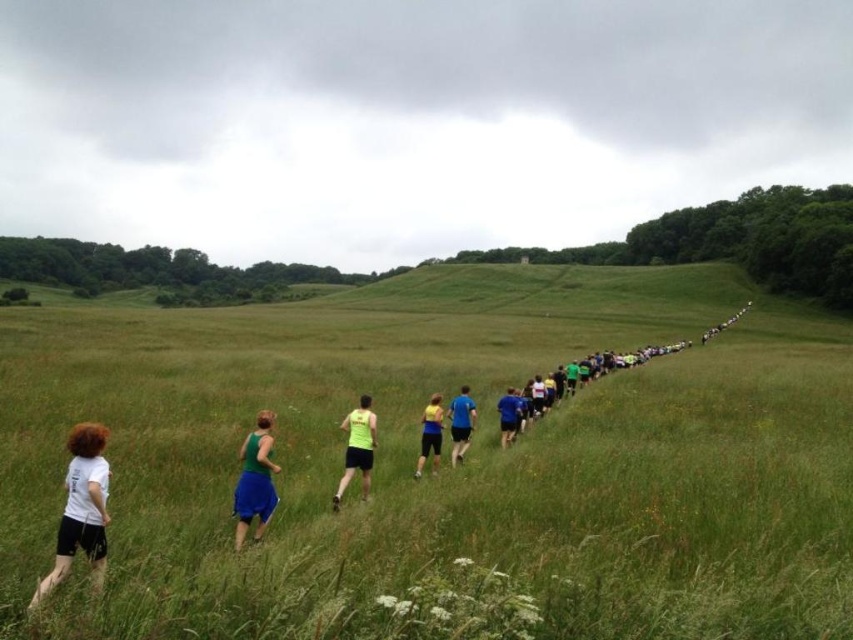
Question: Does green fabric skirt at lower left come behind blue fabric shorts at center?

Choices:
 (A) no
 (B) yes

Answer: (A)

Question: In this image, where is neon yellow tank top at center located relative to yellow fabric shorts at center?

Choices:
 (A) above
 (B) below

Answer: (A)

Question: Which point appears farthest from the camera in this image?

Choices:
 (A) (376, 541)
 (B) (456, 396)

Answer: (B)

Question: Does green grassy field at center have a larger size compared to white matte t-shirt at lower left?

Choices:
 (A) no
 (B) yes

Answer: (B)

Question: Which point is farther from the camera taking this photo?

Choices:
 (A) (502, 420)
 (B) (416, 474)
 (C) (80, 509)

Answer: (A)

Question: Among these objects, which one is farthest from the camera?

Choices:
 (A) green grassy field at center
 (B) neon yellow tank top at center
 (C) yellow fabric shorts at center

Answer: (B)